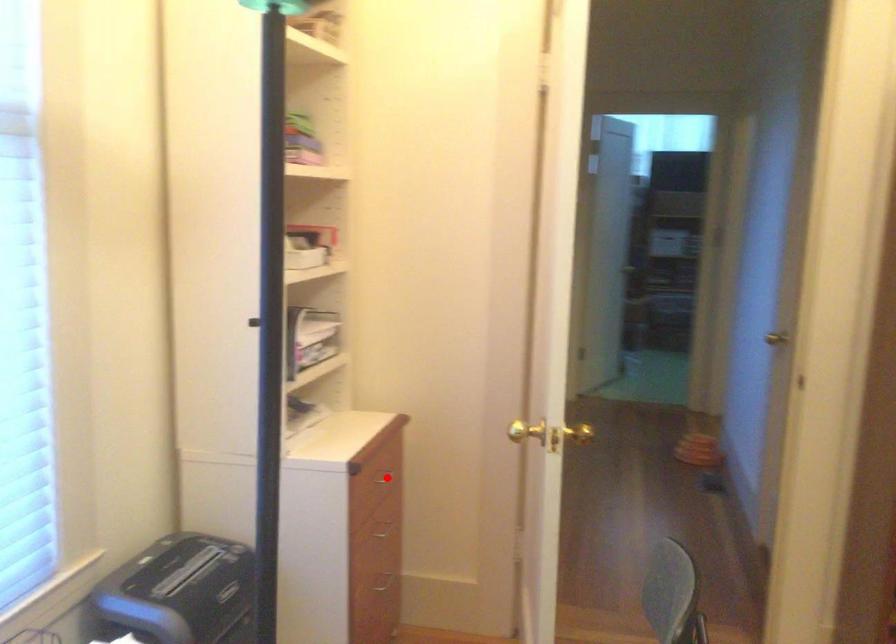
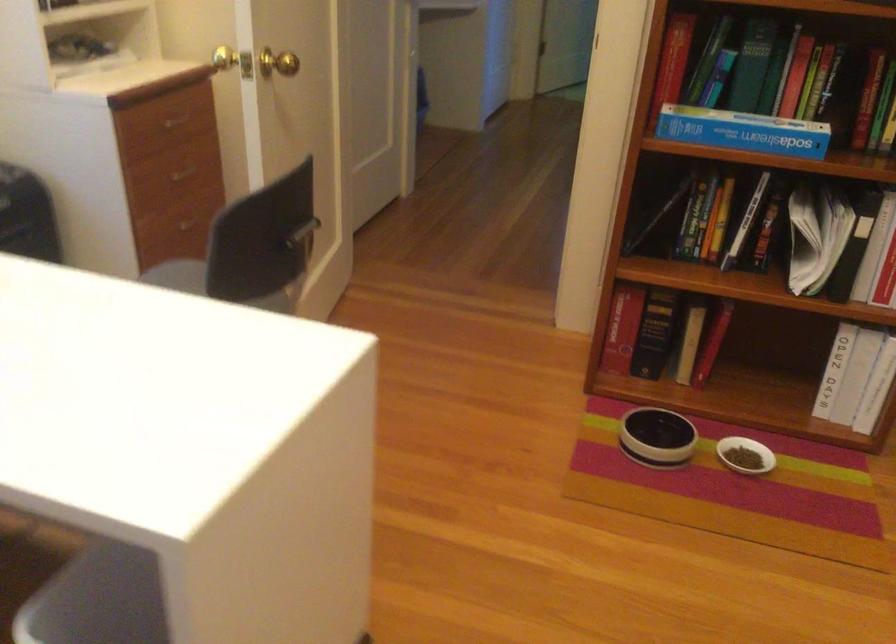
Find the pixel in the second image that matches the highlighted location in the first image.

(178, 122)